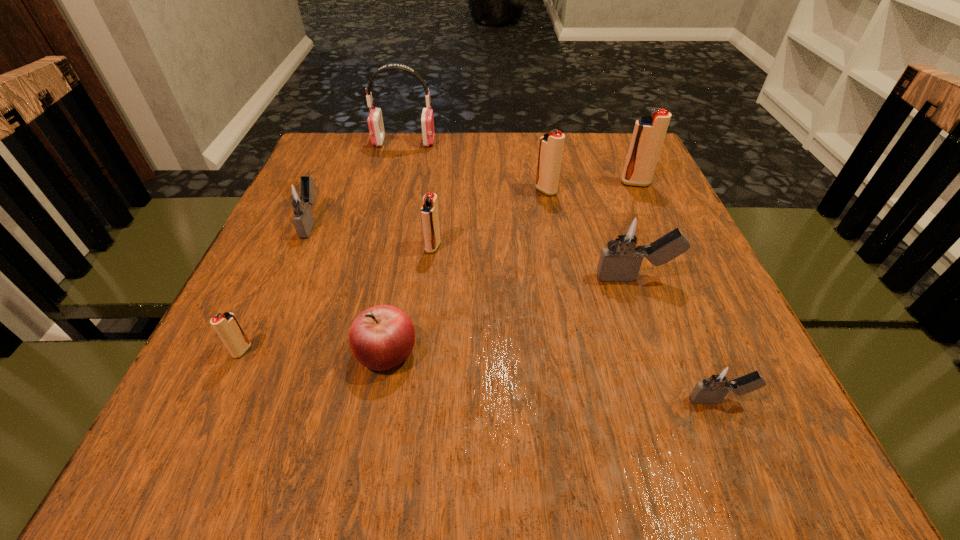
Where is `the fourth nearest igniter`? This screenshot has width=960, height=540. the fourth nearest igniter is located at coordinates (429, 211).

Where is `the third biggest red igniter`? The height and width of the screenshot is (540, 960). the third biggest red igniter is located at coordinates (429, 211).

The width and height of the screenshot is (960, 540). I want to click on apple, so click(x=381, y=337).

Find the location of a particular element. the smallest red igniter is located at coordinates (226, 325).

Find the location of a particular element. the nearest red igniter is located at coordinates (226, 325).

Where is `the nearest gray igniter`? This screenshot has width=960, height=540. the nearest gray igniter is located at coordinates (720, 378).

Where is `the nearest object`? the nearest object is located at coordinates (720, 378).

Find the location of `blank area located 0.350m on the outer surface of the earphone`. blank area located 0.350m on the outer surface of the earphone is located at coordinates (564, 142).

Locate an element on the screen. free space located on the left of the rightmost red igniter is located at coordinates (537, 183).

Identify the location of free spot located on the front of the third red igniter from left to right. The height and width of the screenshot is (540, 960). (561, 271).